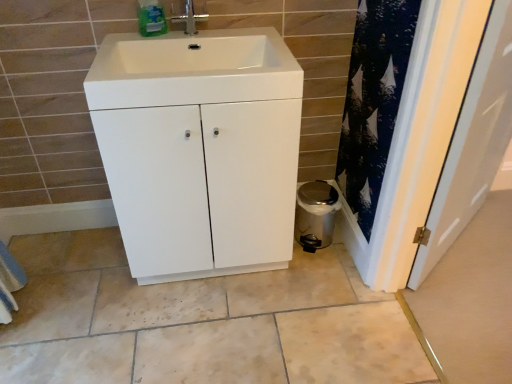
This screenshot has width=512, height=384. In order to click on vacant space to the right of white glossy door at right in this screenshot , I will do `click(489, 243)`.